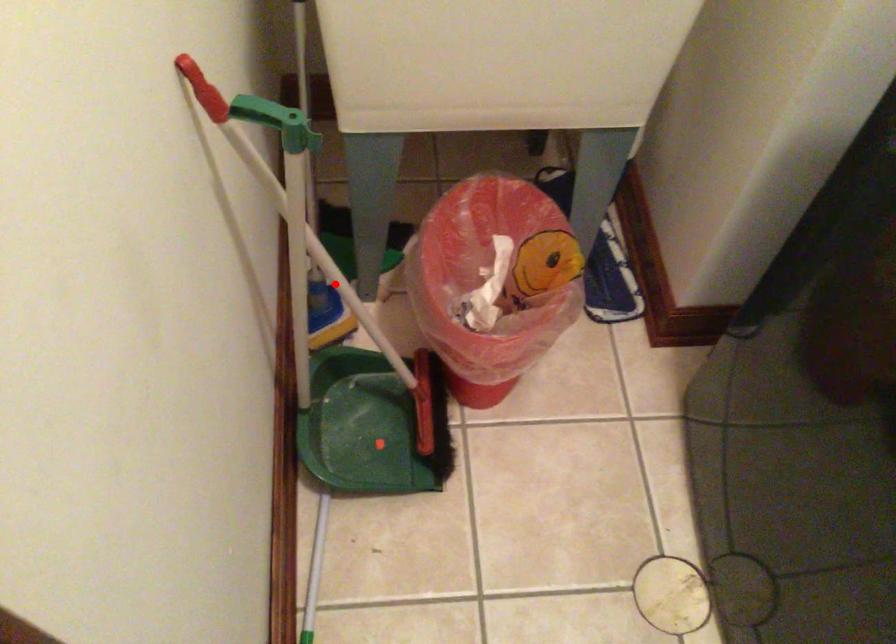
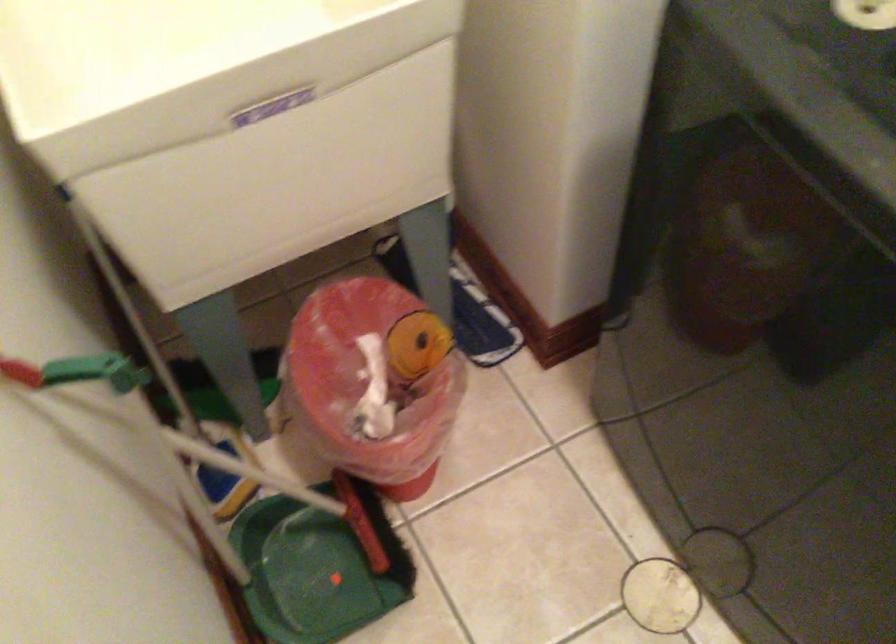
In the second image, find the point that corresponds to the highlighted location in the first image.

(228, 462)